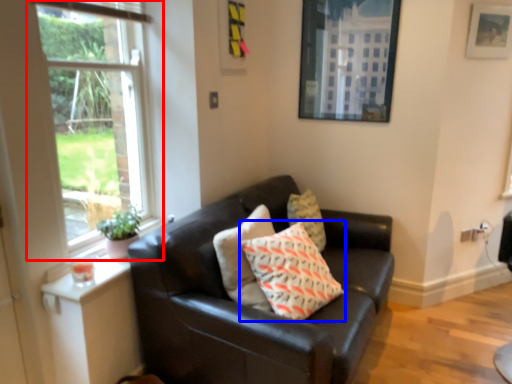
Question: Which point is further to the camera, window (highlighted by a red box) or pillow (highlighted by a blue box)?

Choices:
 (A) window
 (B) pillow

Answer: (B)